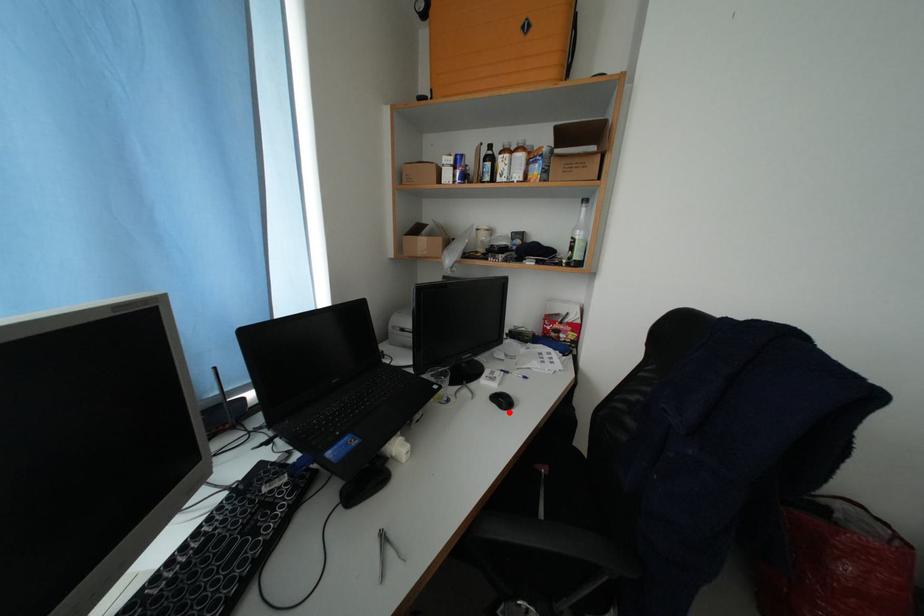
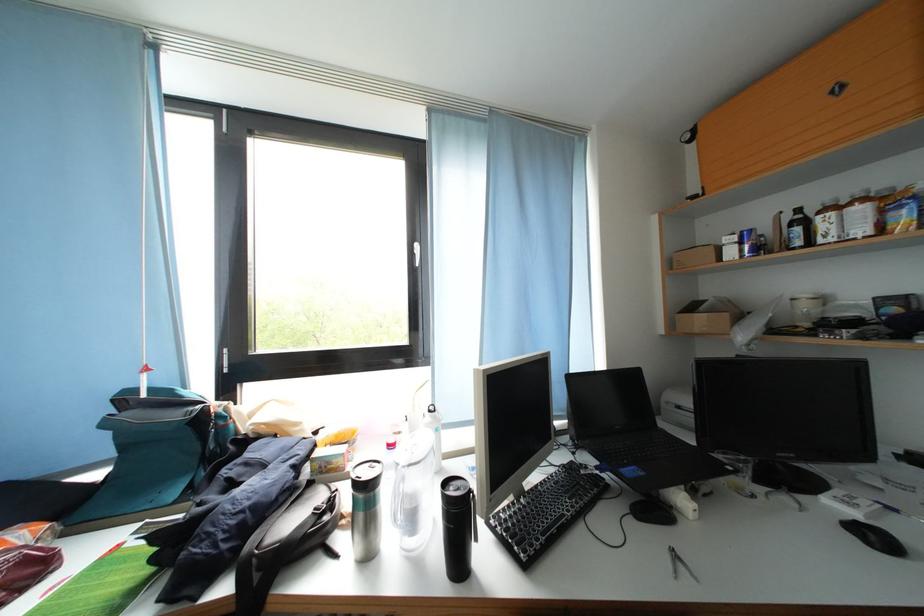
Find the pixel in the second image that matches the highlighted location in the first image.

(877, 548)